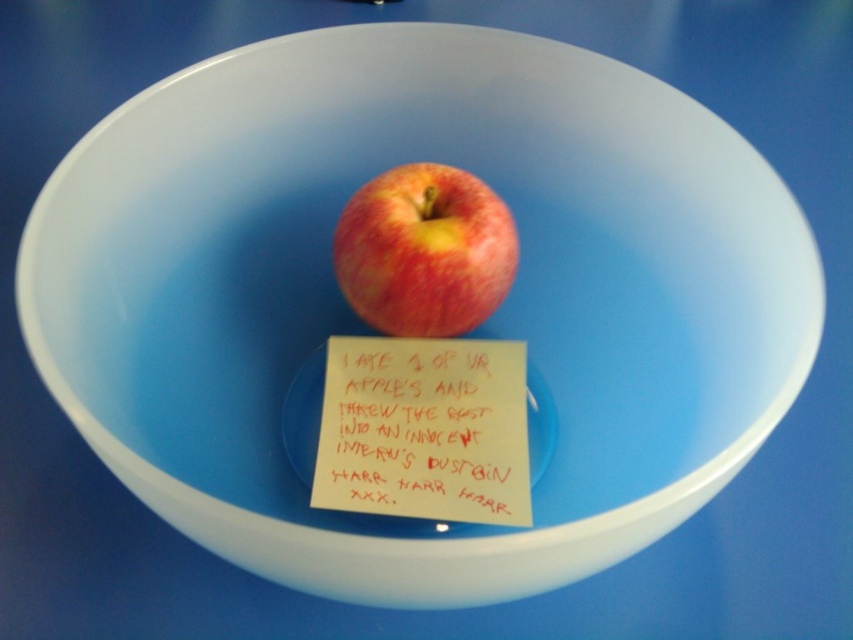
Which of these two, white paper at center or shiny red apple at center, stands shorter?

white paper at center is shorter.

Which is in front, point (503, 484) or point (421, 212)?

Point (503, 484) is more forward.

What do you see at coordinates (424, 429) in the screenshot? The width and height of the screenshot is (853, 640). I see `white paper at center` at bounding box center [424, 429].

You are a GUI agent. You are given a task and a screenshot of the screen. Output one action in this format:
    pyautogui.click(x=<x>, y=<y>)
    Task: Click on the white paper at center
    This screenshot has height=640, width=853.
    Given the screenshot: What is the action you would take?
    pyautogui.click(x=424, y=429)